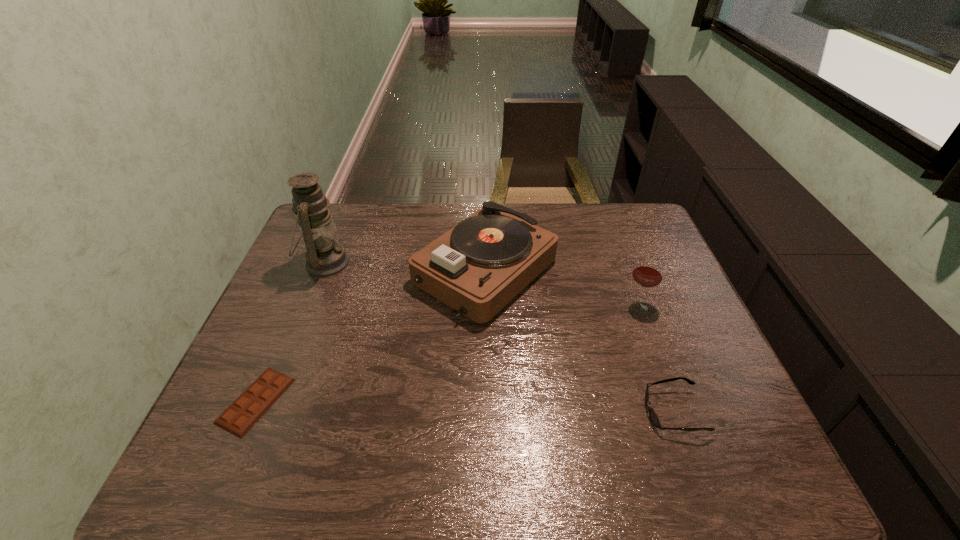
Locate an element on the screen. The height and width of the screenshot is (540, 960). free space between the chocolate bar and the wineglass is located at coordinates (447, 353).

You are a GUI agent. You are given a task and a screenshot of the screen. Output one action in this format:
    pyautogui.click(x=<x>, y=<y>)
    Task: Click on the free space between the third object from left to right and the oil lamp
    The height and width of the screenshot is (540, 960).
    Given the screenshot: What is the action you would take?
    pyautogui.click(x=405, y=267)

At what (x,y) coordinates should I click in order to perform the action: click on vacant region between the wineglass and the shortest object. Please return your answer as a coordinate pair (x, y). Image resolution: width=960 pixels, height=540 pixels. Looking at the image, I should click on (447, 353).

Where is `empty space that is in between the record player and the second shortest object`? empty space that is in between the record player and the second shortest object is located at coordinates (579, 341).

Where is `free spot between the wineglass and the third object from right to left`? This screenshot has height=540, width=960. free spot between the wineglass and the third object from right to left is located at coordinates (562, 288).

What are the coordinates of `free space between the oil lamp and the shortest object` in the screenshot? It's located at (291, 333).

Image resolution: width=960 pixels, height=540 pixels. I want to click on vacant space that's between the oil lamp and the third object from right to left, so click(405, 267).

The height and width of the screenshot is (540, 960). Find the location of `vacant space that's between the record player and the chocolate bar`. vacant space that's between the record player and the chocolate bar is located at coordinates (371, 336).

Where is `the closest object to the tallest object`? The width and height of the screenshot is (960, 540). the closest object to the tallest object is located at coordinates (477, 267).

What are the coordinates of `the fourth closest object relative to the chocolate bar` in the screenshot? It's located at (648, 273).